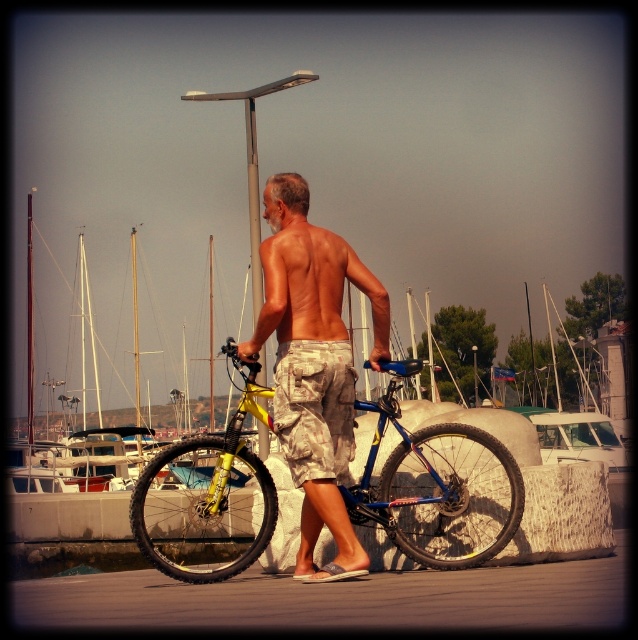
Does yellow matte bicycle at center appear on the right side of metallic pole at center?

Yes, yellow matte bicycle at center is to the right of metallic pole at center.

Does yellow matte bicycle at center appear over metallic pole at center?

No, yellow matte bicycle at center is not above metallic pole at center.

Image resolution: width=638 pixels, height=640 pixels. What do you see at coordinates (438, 486) in the screenshot? I see `yellow matte bicycle at center` at bounding box center [438, 486].

Where is `yellow matte bicycle at center`? The width and height of the screenshot is (638, 640). yellow matte bicycle at center is located at coordinates (438, 486).

Who is positioned more to the left, camouflage fabric shorts at center or metallic pole at center?

metallic pole at center

Can you confirm if camouflage fabric shorts at center is smaller than metallic pole at center?

Correct, camouflage fabric shorts at center occupies less space than metallic pole at center.

Locate an element on the screen. camouflage fabric shorts at center is located at coordinates (315, 408).

At what (x,y) coordinates should I click in order to perform the action: click on camouflage fabric shorts at center. Please return your answer as a coordinate pair (x, y). The width and height of the screenshot is (638, 640). Looking at the image, I should click on (315, 408).

Which is above, camouflage shorts at center or muscular tan skin at back?

muscular tan skin at back is above.

Is camouflage shorts at center further to camera compared to muscular tan skin at back?

That is True.

Is point (313, 260) positioned after point (330, 243)?

That is False.

Where is `camouflage shorts at center`? Image resolution: width=638 pixels, height=640 pixels. camouflage shorts at center is located at coordinates (313, 364).